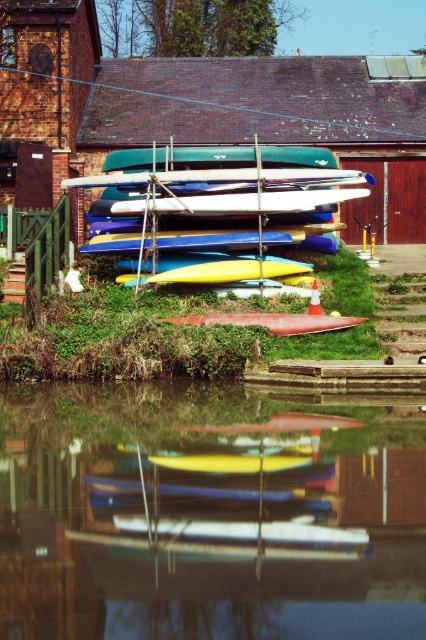
Question: Does glossy water at lower center have a greater width compared to yellow matte kayak at center?

Choices:
 (A) no
 (B) yes

Answer: (A)

Question: Which object is farther from the camera taking this photo?

Choices:
 (A) smooth red canoe at center
 (B) glossy water at lower center

Answer: (A)

Question: Which point is closer to the camera?

Choices:
 (A) (279, 330)
 (B) (238, 576)

Answer: (B)

Question: Does glossy water at lower center have a larger size compared to smooth red canoe at center?

Choices:
 (A) no
 (B) yes

Answer: (A)

Question: Does glossy water at lower center have a larger size compared to smooth red canoe at center?

Choices:
 (A) yes
 (B) no

Answer: (B)

Question: Estimate the real-world distances between objects in this image. Which object is closer to the smooth red canoe at center?

Choices:
 (A) yellow matte kayak at center
 (B) glossy water at lower center

Answer: (A)